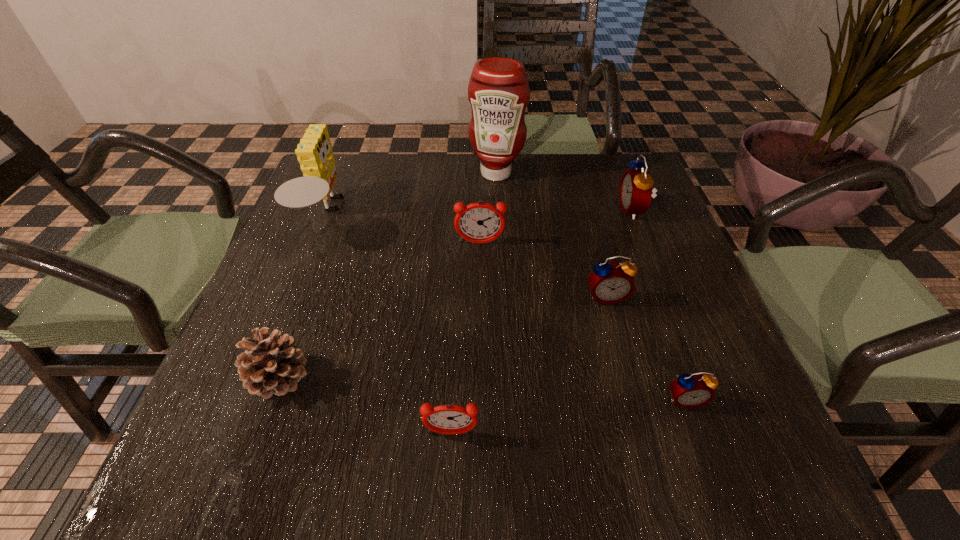
Find the location of a particular element. brown pinecone is located at coordinates (270, 365).

Locate an element on the screen. The width and height of the screenshot is (960, 540). the smaller reddish-pink alarm clock is located at coordinates (449, 419).

Identify the location of the nearest alarm clock. (449, 419).

At what (x,y) coordinates should I click in order to perform the action: click on the nearest red alarm clock. Please return your answer as a coordinate pair (x, y). Looking at the image, I should click on (694, 390).

You are a GUI agent. You are given a task and a screenshot of the screen. Output one action in this format:
    pyautogui.click(x=<x>, y=<y>)
    Task: Click on the fourth farthest alarm clock
    
    Given the screenshot: What is the action you would take?
    pyautogui.click(x=694, y=390)

Image resolution: width=960 pixels, height=540 pixels. I want to click on vacant space located on the front of the red condiment, so click(x=499, y=241).

This screenshot has height=540, width=960. I want to click on free space located 0.190m on the front-facing side of the yellow sponge, so click(426, 214).

At what (x,y) coordinates should I click in order to perform the action: click on free space located on the front-facing side of the sixth shortest object. Please return your answer as a coordinate pair (x, y). This screenshot has width=960, height=540. Looking at the image, I should click on (557, 210).

You are a GUI agent. You are given a task and a screenshot of the screen. Output one action in this format:
    pyautogui.click(x=<x>, y=<y>)
    Task: Click on the vacant space located on the front-facing side of the sixth shortest object
    The height and width of the screenshot is (540, 960).
    Given the screenshot: What is the action you would take?
    pyautogui.click(x=501, y=210)

In order to click on vacant space located 0.320m on the front-facing side of the sixth shortest object in this screenshot , I will do `click(493, 210)`.